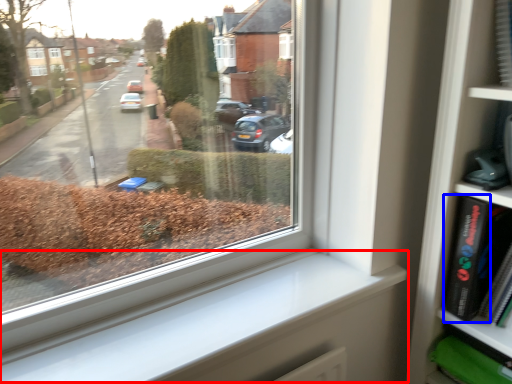
Question: Among these objects, which one is farthest to the camera, window sill (highlighted by a red box) or paperback book (highlighted by a blue box)?

Choices:
 (A) window sill
 (B) paperback book

Answer: (B)